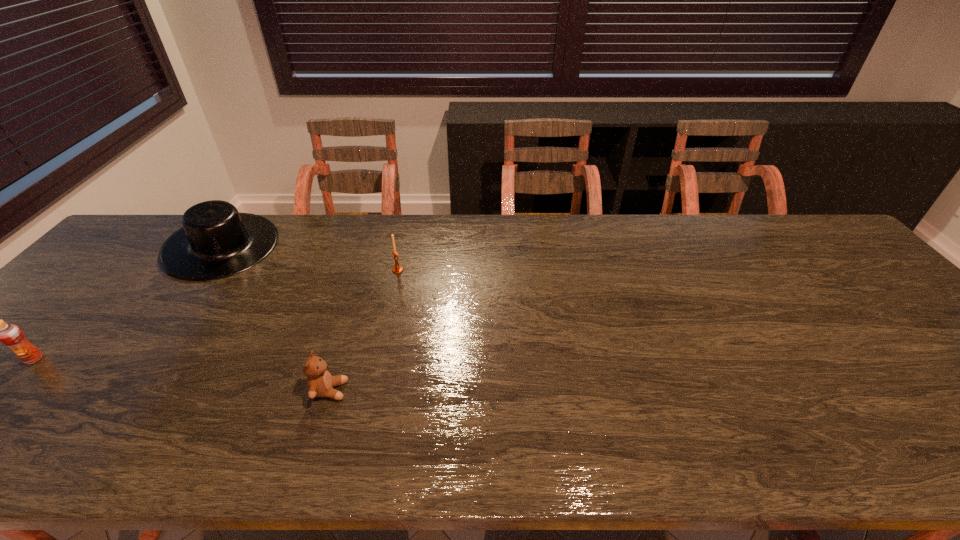
I want to click on the third object from right to left, so click(216, 241).

Find the location of a particular element. candle_holder is located at coordinates (397, 269).

Find the location of a particular element. Image resolution: width=960 pixels, height=540 pixels. the leftmost object is located at coordinates (11, 335).

Image resolution: width=960 pixels, height=540 pixels. I want to click on orange juice, so click(11, 335).

Locate an element on the screen. The image size is (960, 540). the nearest object is located at coordinates pyautogui.click(x=320, y=383).

Find the location of `teddy bear`. teddy bear is located at coordinates (320, 383).

You are a GUI agent. You are given a task and a screenshot of the screen. Output one action in this format:
    pyautogui.click(x=<x>, y=<y>)
    Task: Click on the vacant space located 0.150m on the right of the dress hat
    
    Given the screenshot: What is the action you would take?
    pyautogui.click(x=324, y=246)

This screenshot has width=960, height=540. What are the coordinates of `vacant region located on the back of the candle_holder` in the screenshot? It's located at (409, 219).

The width and height of the screenshot is (960, 540). I want to click on free spot located 0.240m on the right of the orange juice, so click(x=145, y=359).

The width and height of the screenshot is (960, 540). I want to click on blank space located 0.390m on the front-facing side of the nearest object, so click(524, 390).